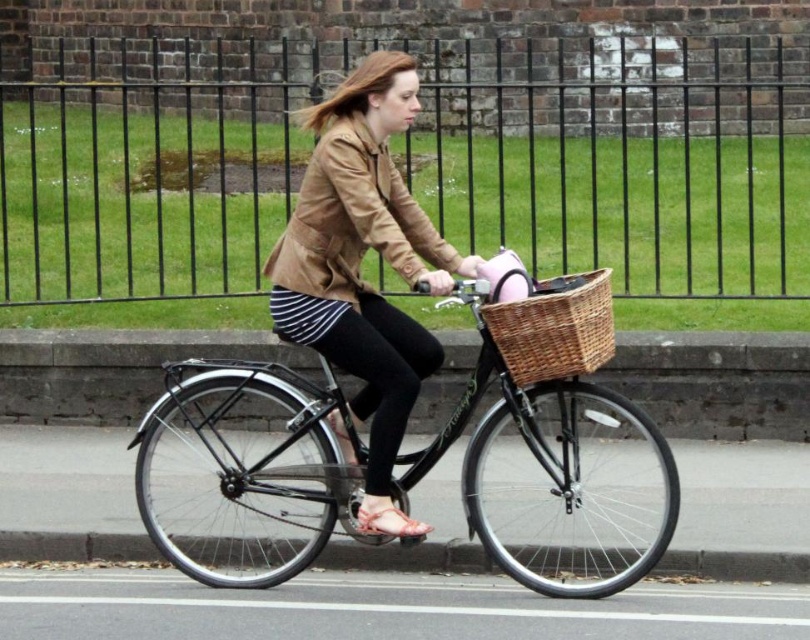
Between black matte bicycle at center and pink fabric helmet at center, which one is positioned higher?

pink fabric helmet at center

Locate an element on the screen. black matte bicycle at center is located at coordinates (553, 451).

Locate an element on the screen. This screenshot has height=640, width=810. black iron fence at upper center is located at coordinates (625, 164).

Is black iron fence at upper center further to the viewer compared to black matte bicycle at center?

That is True.

Who is more distant from viewer, (81,208) or (258,576)?

Point (81,208)

Where is `black iron fence at upper center`? This screenshot has width=810, height=640. black iron fence at upper center is located at coordinates (625, 164).

Identify the location of tan leather jacket at center. (352, 220).

Can you confirm if tan leather jacket at center is positioned to the left of pink fabric helmet at center?

Correct, you'll find tan leather jacket at center to the left of pink fabric helmet at center.

Identify the location of tan leather jacket at center. This screenshot has width=810, height=640. (352, 220).